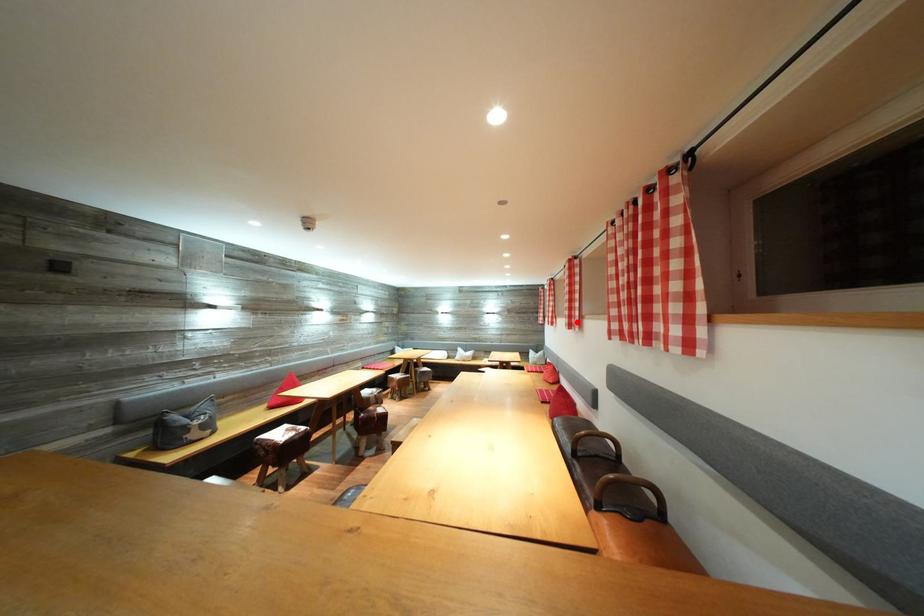
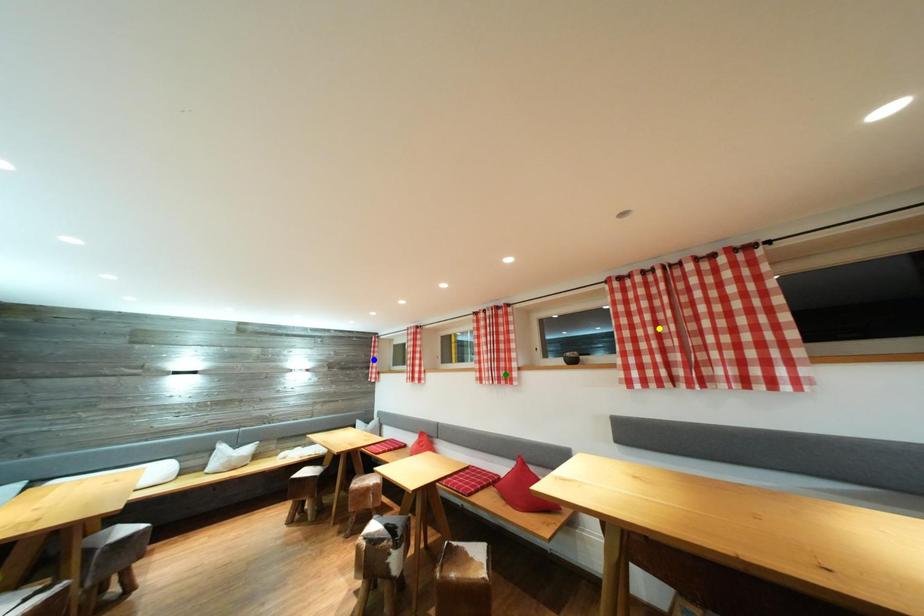
Question: I am providing you with two images of the same scene from different viewpoints. A red point is marked on the first image. You are given multiple points on the second image. Which spot in image 2 lines up with the point in image 1?

Choices:
 (A) green point
 (B) blue point
 (C) yellow point

Answer: (A)